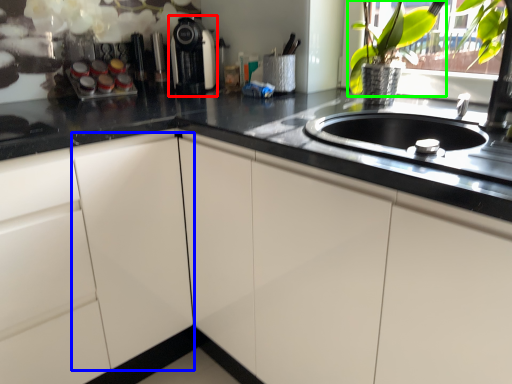
Question: Which is farther away from coffee machine (highlighted by a red box)? cabinetry (highlighted by a blue box) or floral arrangement (highlighted by a green box)?

Choices:
 (A) cabinetry
 (B) floral arrangement

Answer: (A)